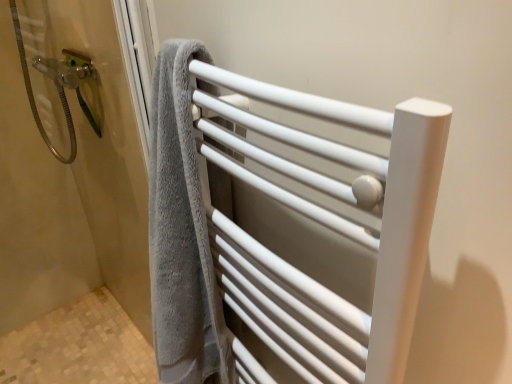
Question: Considering their positions, is white matte towel rack at center located in front of or behind gray towel at left?

Choices:
 (A) behind
 (B) front

Answer: (B)

Question: Considering the positions of white matte towel rack at center and gray towel at left in the image, is white matte towel rack at center taller or shorter than gray towel at left?

Choices:
 (A) short
 (B) tall

Answer: (A)

Question: Would you say white matte towel rack at center is to the left or to the right of gray towel at left in the picture?

Choices:
 (A) right
 (B) left

Answer: (A)

Question: In the image, is gray towel at left positioned in front of or behind white matte towel rack at center?

Choices:
 (A) front
 (B) behind

Answer: (B)

Question: Is gray towel at left wider or thinner than white matte towel rack at center?

Choices:
 (A) thin
 (B) wide

Answer: (A)

Question: From a real-world perspective, relative to white matte towel rack at center, is gray towel at left vertically above or below?

Choices:
 (A) above
 (B) below

Answer: (B)

Question: Is gray towel at left to the left or to the right of white matte towel rack at center in the image?

Choices:
 (A) right
 (B) left

Answer: (B)